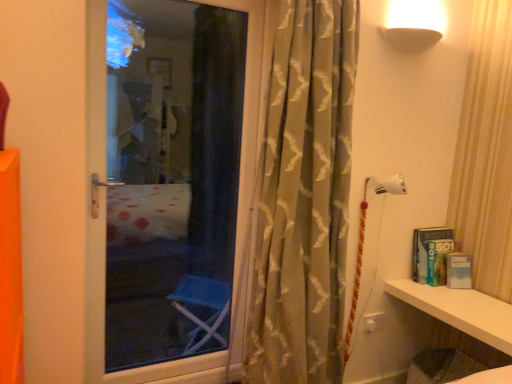
Identify the location of free space above white glossy shelf at lower right (from a real-world perspective). This screenshot has width=512, height=384. (468, 303).